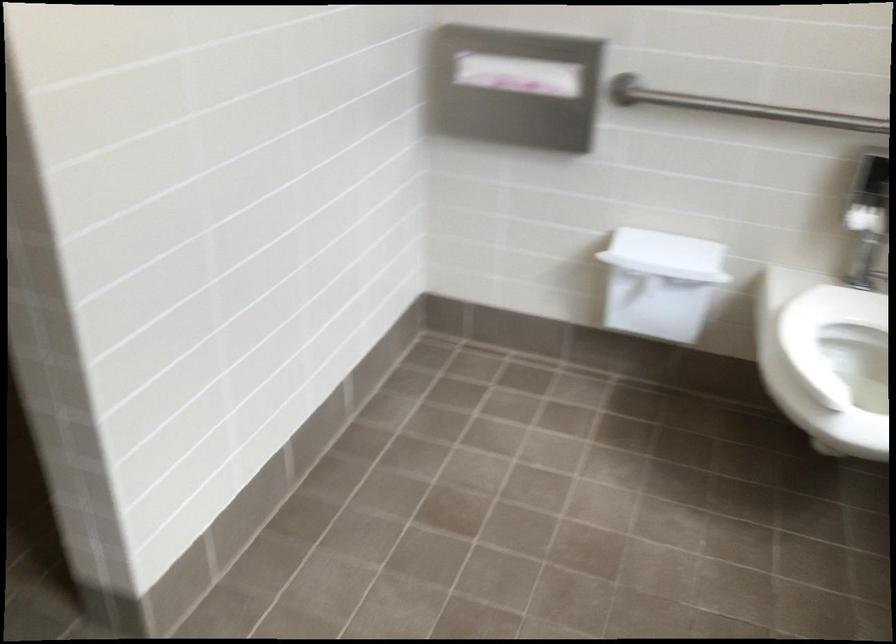
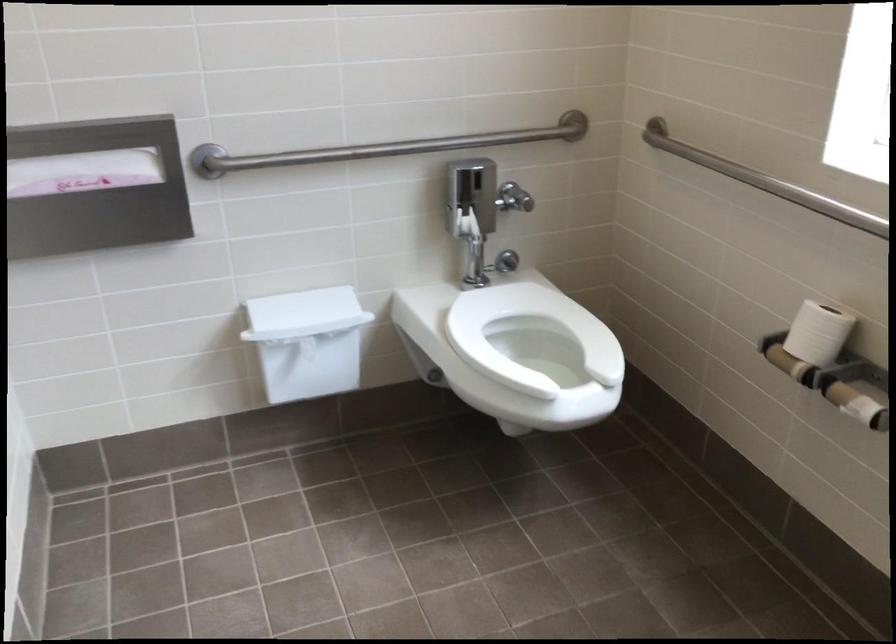
Where in the second image is the point corresponding to the point at 805,111 from the first image?

(382, 147)